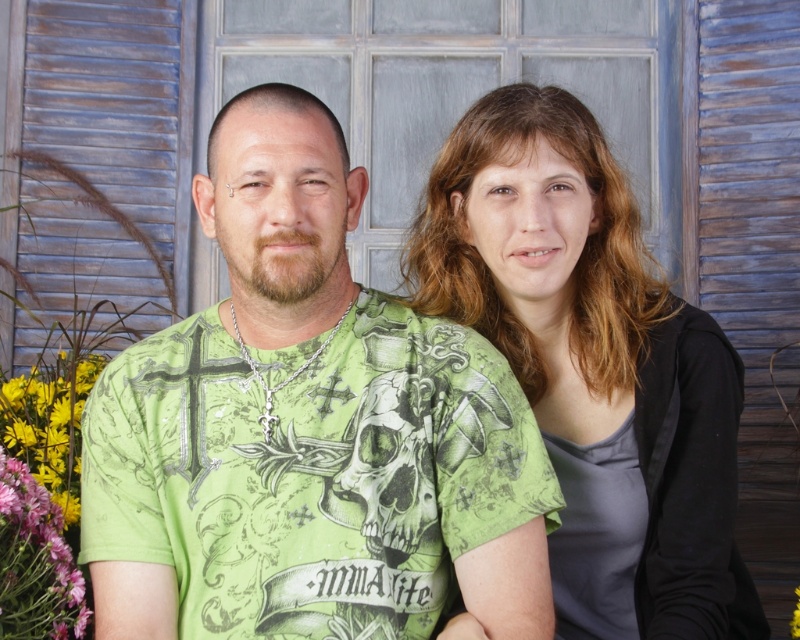
Question: Which point appears farthest from the camera in this image?

Choices:
 (A) (29, 410)
 (B) (345, 436)
 (C) (694, 634)

Answer: (A)

Question: Does matte green shirt at center have a lesser width compared to pink fabric at lower left?

Choices:
 (A) yes
 (B) no

Answer: (B)

Question: Among these objects, which one is nearest to the camera?

Choices:
 (A) matte green shirt at center
 (B) pink fabric at lower left

Answer: (A)

Question: Is green printed t-shirt at center thinner than pink fabric at lower left?

Choices:
 (A) no
 (B) yes

Answer: (A)

Question: Which point is farther to the camera?

Choices:
 (A) (552, 348)
 (B) (26, 476)

Answer: (A)

Question: In this image, where is green printed t-shirt at center located relative to pink fabric at lower left?

Choices:
 (A) right
 (B) left

Answer: (A)